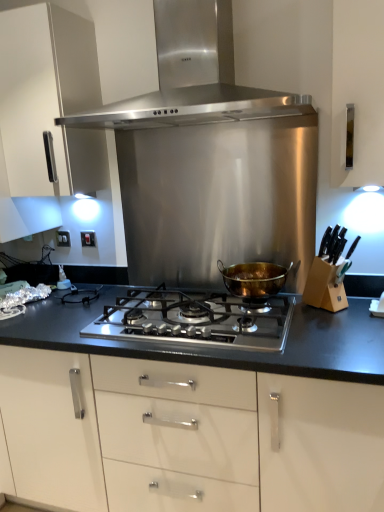
Question: Is white plastic electric outlet at left, which ranks as the 1th electric outlet in back-to-front order, outside white plastic electric outlet at left, arranged as the 2th electric outlet when viewed from the back?

Choices:
 (A) no
 (B) yes

Answer: (B)

Question: Is white plastic electric outlet at left, which appears as the second electric outlet when viewed from the front, wider than white plastic electric outlet at left, arranged as the second electric outlet when viewed from the left?

Choices:
 (A) no
 (B) yes

Answer: (A)

Question: Is the depth of white plastic electric outlet at left, which appears as the 1th electric outlet when viewed from the left, greater than that of white plastic electric outlet at left, arranged as the 2th electric outlet when viewed from the back?

Choices:
 (A) no
 (B) yes

Answer: (B)

Question: Does white plastic electric outlet at left, which ranks as the 1th electric outlet in back-to-front order, appear on the left side of white plastic electric outlet at left, the first electric outlet viewed from the right?

Choices:
 (A) yes
 (B) no

Answer: (A)

Question: Does white plastic electric outlet at left, which appears as the 1th electric outlet when viewed from the left, have a greater height compared to white plastic electric outlet at left, arranged as the second electric outlet when viewed from the left?

Choices:
 (A) yes
 (B) no

Answer: (B)

Question: Looking at the image, does stainless steel range hood at upper center, which is counted as the 1th kitchen appliance, starting from the top, seem bigger or smaller compared to gold metallic pot at center, the second kitchen appliance positioned from the top?

Choices:
 (A) big
 (B) small

Answer: (A)

Question: Is stainless steel range hood at upper center, which is counted as the 1th kitchen appliance, starting from the top, in front of or behind gold metallic pot at center, the second kitchen appliance positioned from the top, in the image?

Choices:
 (A) behind
 (B) front

Answer: (B)

Question: In terms of height, does stainless steel range hood at upper center, which is counted as the 1th kitchen appliance, starting from the top, look taller or shorter compared to gold metallic pot at center, the second kitchen appliance positioned from the top?

Choices:
 (A) tall
 (B) short

Answer: (A)

Question: Do you think stainless steel range hood at upper center, which is counted as the 1th kitchen appliance, starting from the top, is within gold metallic pot at center, the first kitchen appliance when ordered from bottom to top, or outside of it?

Choices:
 (A) outside
 (B) inside

Answer: (A)

Question: Considering the positions of point (243, 294) and point (18, 119), is point (243, 294) closer or farther from the camera than point (18, 119)?

Choices:
 (A) farther
 (B) closer

Answer: (B)

Question: In the image, is gold metallic pot at center, the first kitchen appliance when ordered from bottom to top, positioned in front of or behind white glossy cabinet at upper left?

Choices:
 (A) behind
 (B) front

Answer: (A)

Question: Is gold metallic pot at center, the first kitchen appliance when ordered from bottom to top, bigger or smaller than white glossy cabinet at upper left?

Choices:
 (A) big
 (B) small

Answer: (B)

Question: Visually, is gold metallic pot at center, the second kitchen appliance positioned from the top, positioned to the left or to the right of white glossy cabinet at upper left?

Choices:
 (A) right
 (B) left

Answer: (A)

Question: From the image's perspective, is gold metallic pot at center, the first kitchen appliance when ordered from bottom to top, located above or below stainless steel gas stove at center?

Choices:
 (A) below
 (B) above

Answer: (B)

Question: From a real-world perspective, is gold metallic pot at center, the second kitchen appliance positioned from the top, positioned above or below stainless steel gas stove at center?

Choices:
 (A) below
 (B) above

Answer: (B)